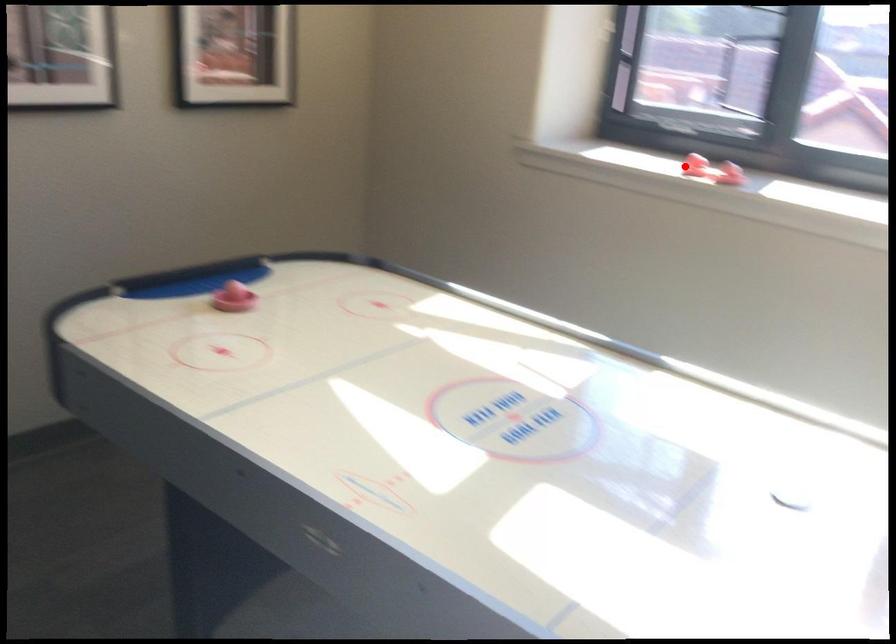
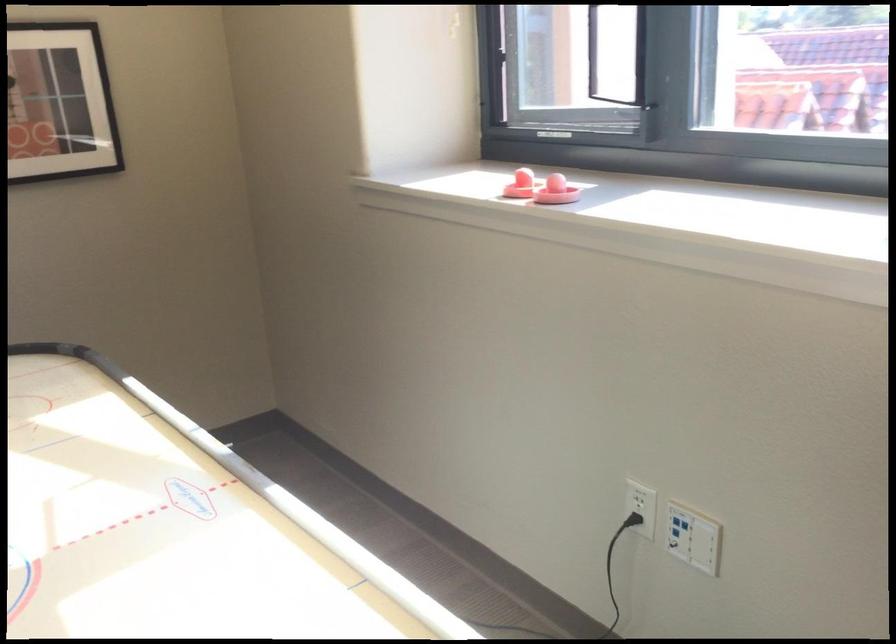
Where in the second image is the point corresponding to the highlighted location from the first image?

(521, 185)